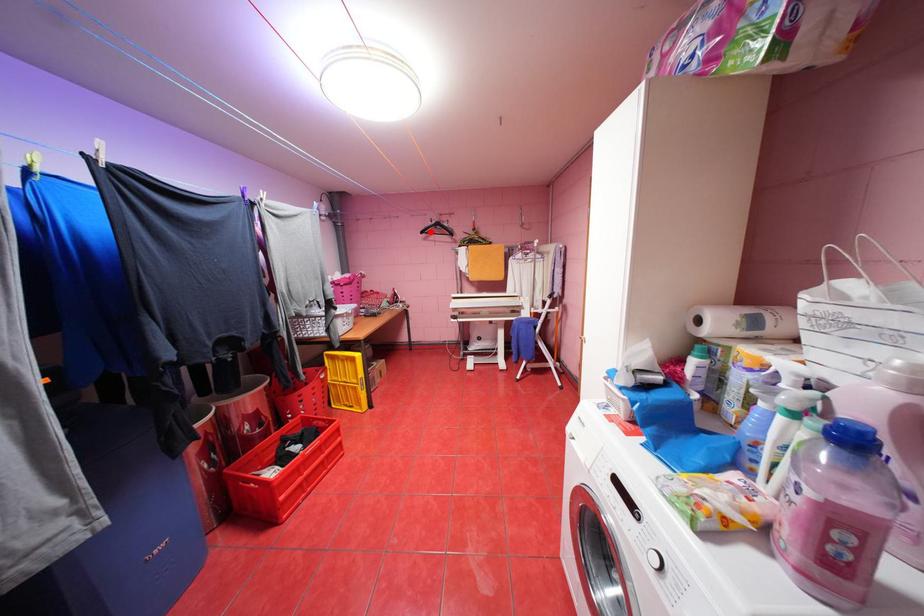
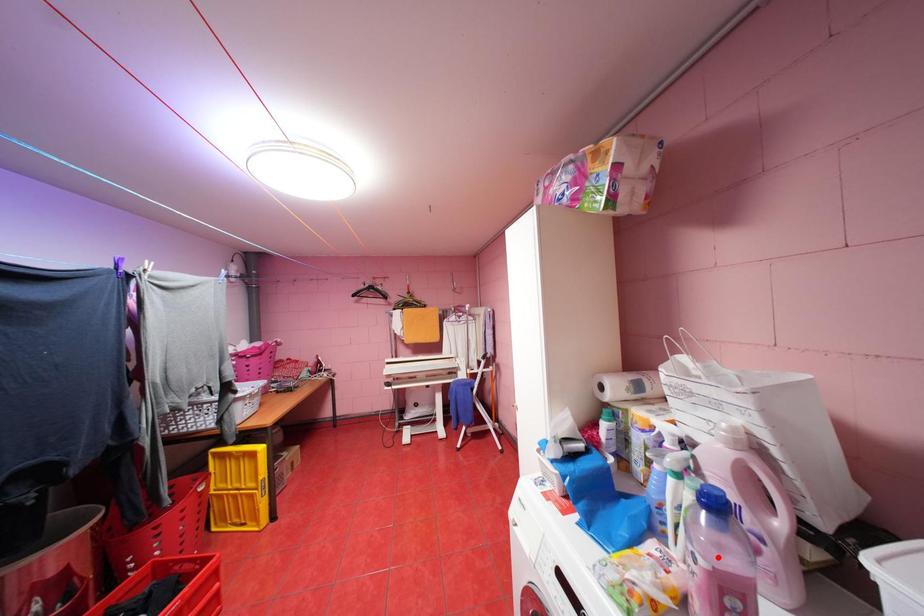
I am providing you with two images of the same scene from different viewpoints. A red point is marked on the first image and another point is marked on the second image. Is the marked point in image1 the same physical position as the marked point in image2?

No